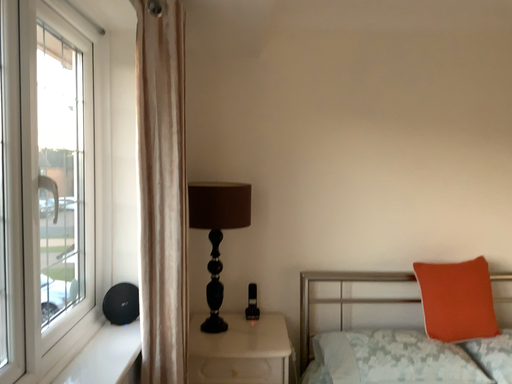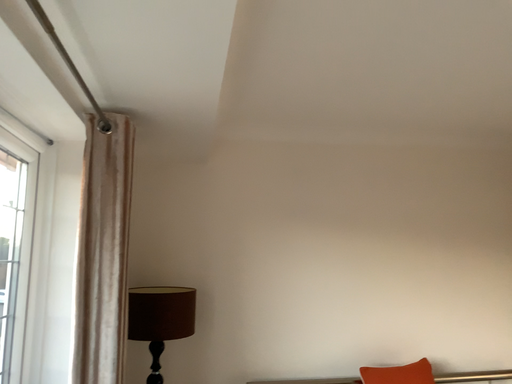
Question: Which way did the camera rotate in the video?

Choices:
 (A) rotated downward
 (B) rotated upward

Answer: (B)